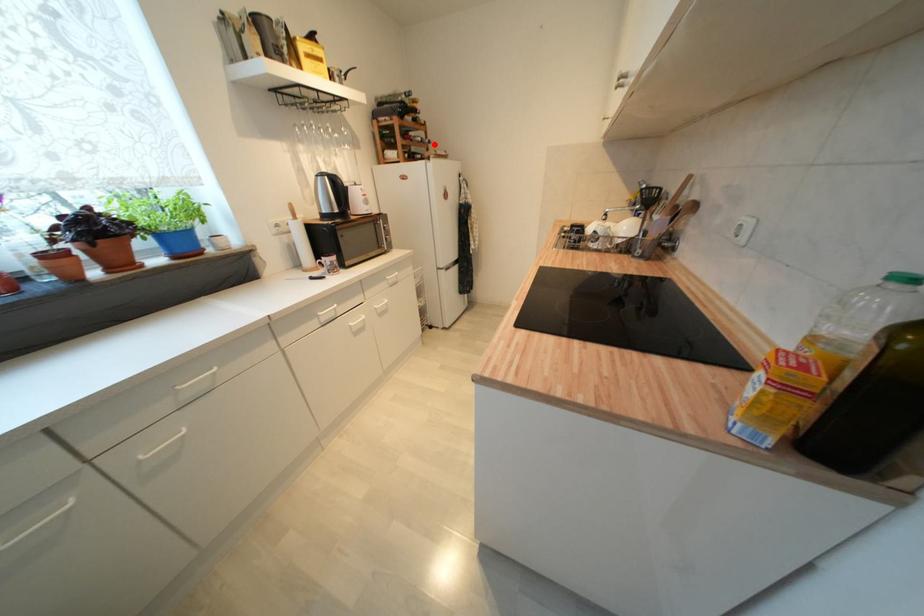
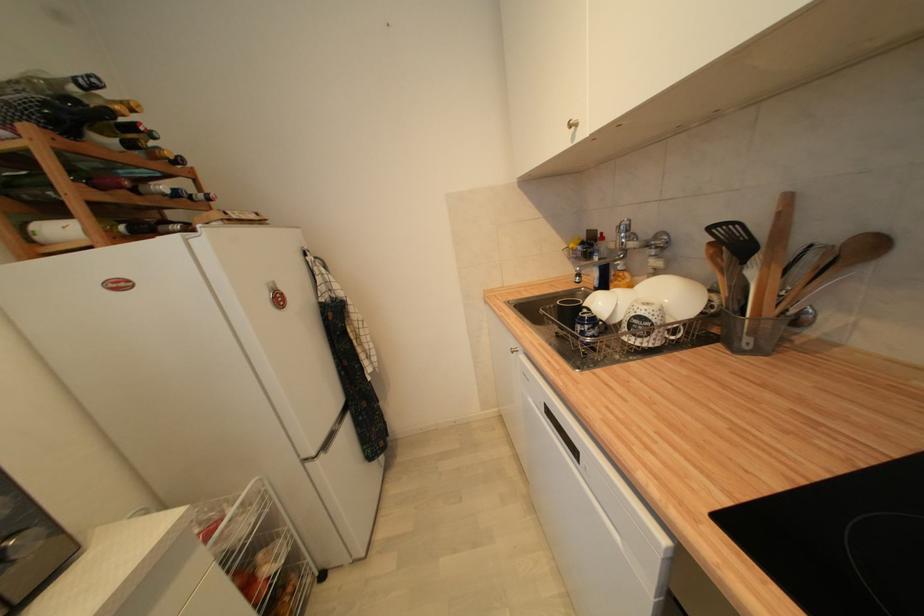
The point at the highlighted location is marked in the first image. Where is the corresponding point in the second image?

(213, 200)